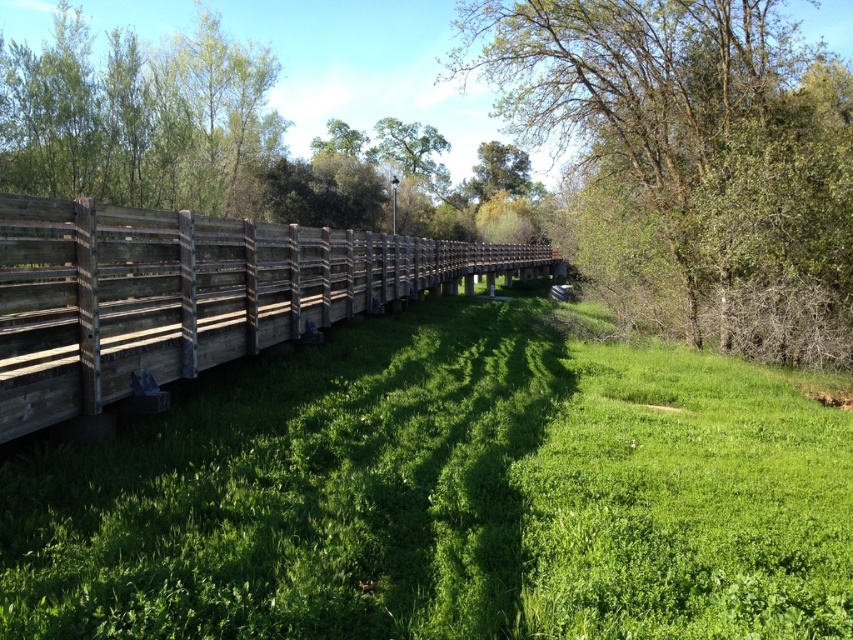
You are planning to take a photo of the green leafy tree at upper right and the weathered wood fence at left. Which object should you focus on first if you want to capture both in a single frame without moving the camera?

The green leafy tree at upper right is bigger than the weathered wood fence at left, so you should focus on the green leafy tree at upper right first to ensure it fills the frame appropriately before adjusting for the smaller fence.

You are standing on the wooden bridge and looking towards the weathered wood fence at left and the green leafy tree at upper center. Which object appears wider from your current position?

The weathered wood fence at left might be wider than the green leafy tree at upper center, so it likely appears wider from your current position on the bridge.

You are a painter standing on the wooden bridge and want to paint the green leafy tree at upper right and the weathered wood fence at left. Which object should you focus on first if you want to paint the one that is closer to you?

The green leafy tree at upper right is closer to you since it is in front of the weathered wood fence at left.